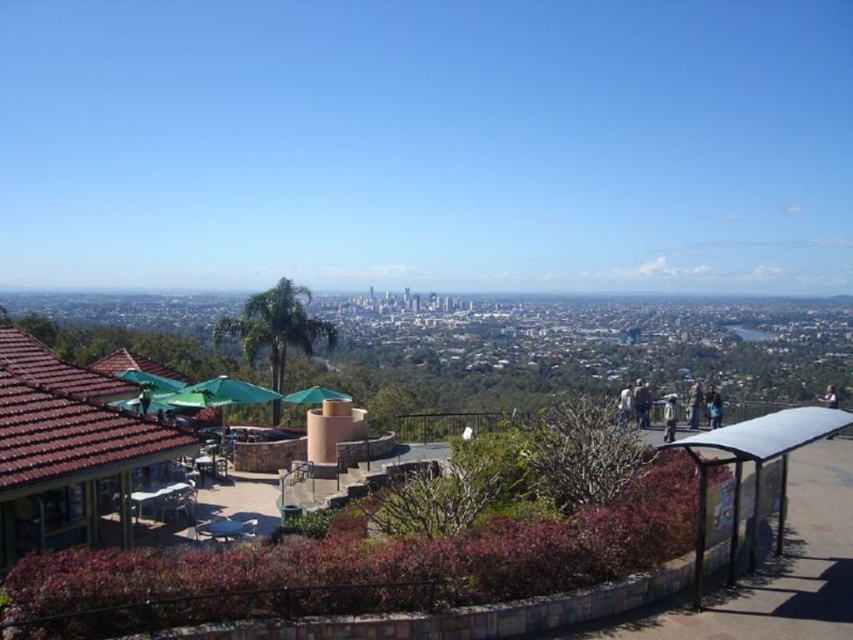
Between dark blue shirt at center right and white fabric person at center-right, which one appears on the left side from the viewer's perspective?

Positioned to the left is white fabric person at center-right.

Does dark blue shirt at center right have a lesser width compared to white fabric person at center-right?

No.

This screenshot has height=640, width=853. I want to click on dark blue shirt at center right, so click(641, 403).

Is point (637, 390) closer to viewer compared to point (820, 397)?

Yes.

From the picture: Does dark blue shirt at center right appear over white fabric umbrella at upper center?

Yes.

Which is in front, point (642, 422) or point (833, 406)?

Point (642, 422) is more forward.

Locate an element on the screen. Image resolution: width=853 pixels, height=640 pixels. dark blue shirt at center right is located at coordinates (641, 403).

Is point (648, 400) positioned behind point (700, 387)?

No, it is in front of (700, 387).

Is dark blue shirt at center right taller than dark blue fabric at lower right?

In fact, dark blue shirt at center right may be shorter than dark blue fabric at lower right.

Is point (636, 390) positioned before point (694, 426)?

No, (636, 390) is further to viewer.

In order to click on dark blue shirt at center right in this screenshot , I will do `click(641, 403)`.